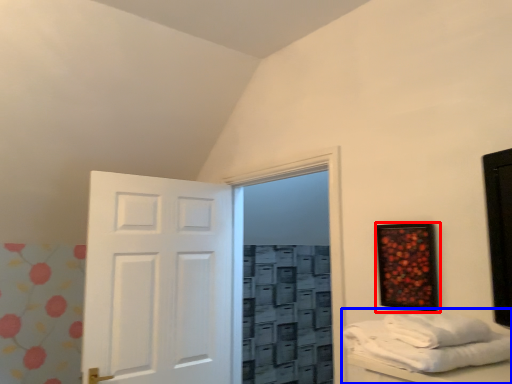
Question: Among these objects, which one is farthest to the camera, picture frame (highlighted by a red box) or furniture (highlighted by a blue box)?

Choices:
 (A) picture frame
 (B) furniture

Answer: (A)